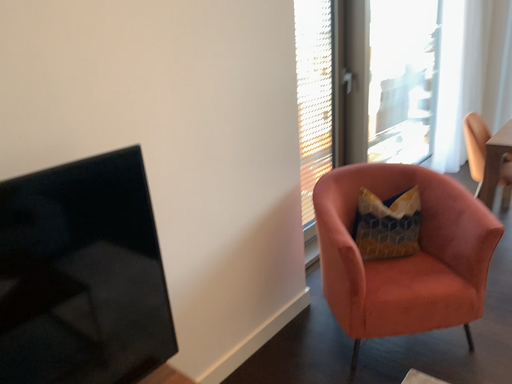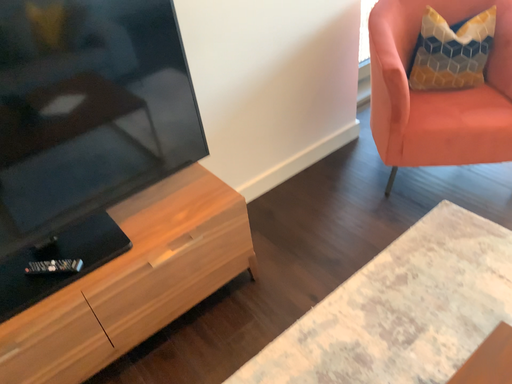
Question: How did the camera likely rotate when shooting the video?

Choices:
 (A) rotated left
 (B) rotated right

Answer: (A)